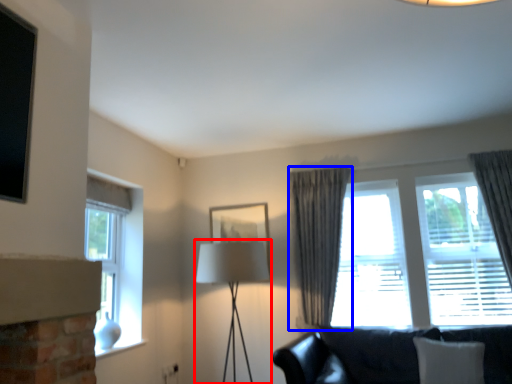
Question: Which object is further to the camera taking this photo, table lamp (highlighted by a red box) or curtain (highlighted by a blue box)?

Choices:
 (A) table lamp
 (B) curtain

Answer: (B)